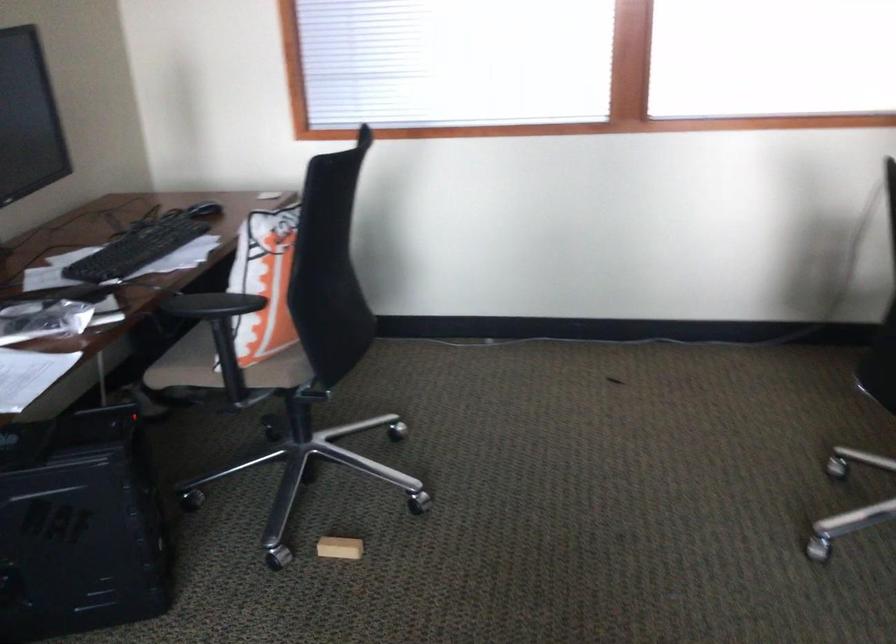
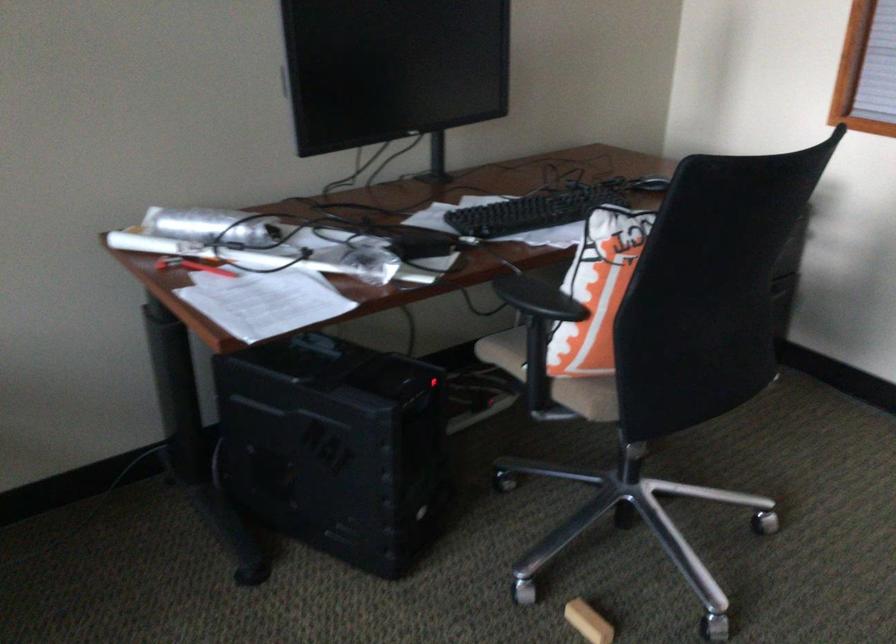
Find the pixel in the second image that matches point (342, 547) in the first image.

(588, 621)